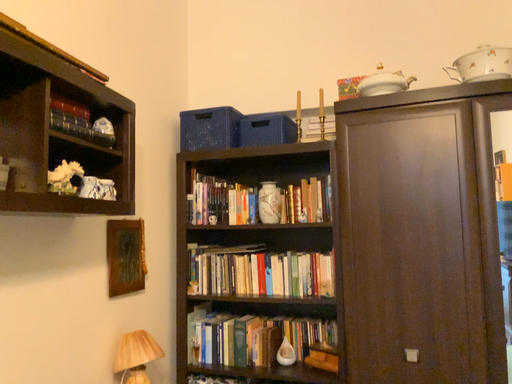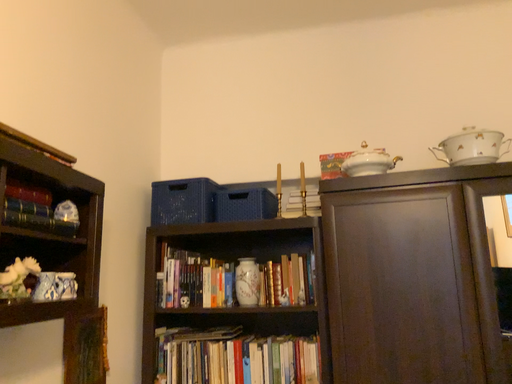
Question: Which way did the camera rotate in the video?

Choices:
 (A) rotated upward
 (B) rotated downward

Answer: (A)